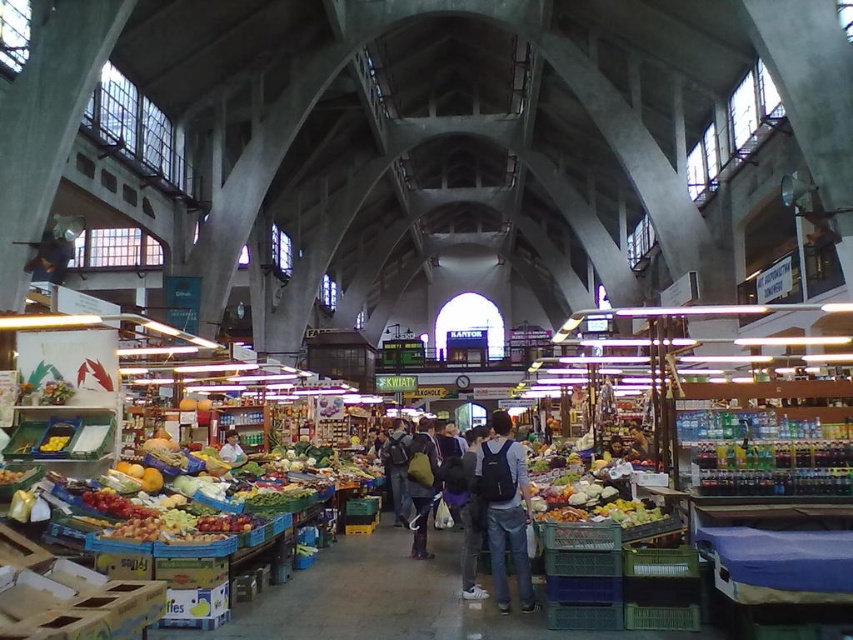
Looking at this image, who is more forward, (514,442) or (225,452)?

Point (514,442) is in front.

Can you confirm if denim jacket at center is taller than light brown leather jacket at center?

Yes, denim jacket at center is taller than light brown leather jacket at center.

Find the location of a particular element. The width and height of the screenshot is (853, 640). denim jacket at center is located at coordinates (505, 508).

Which is more to the right, matte yellow backpack at center or light brown leather jacket at center?

Positioned to the right is matte yellow backpack at center.

Does matte yellow backpack at center have a greater width compared to light brown leather jacket at center?

Yes, matte yellow backpack at center is wider than light brown leather jacket at center.

The width and height of the screenshot is (853, 640). What do you see at coordinates (421, 484) in the screenshot?
I see `matte yellow backpack at center` at bounding box center [421, 484].

The height and width of the screenshot is (640, 853). Find the location of `matte yellow backpack at center`. matte yellow backpack at center is located at coordinates (421, 484).

Between dark blue backpack at center and denim jacket at center, which one is positioned lower?

dark blue backpack at center

Between dark blue backpack at center and denim jacket at center, which one has more height?

dark blue backpack at center is taller.

Is point (496, 566) positioned before point (517, 525)?

No, it is behind (517, 525).

Locate an element on the screen. The width and height of the screenshot is (853, 640). dark blue backpack at center is located at coordinates (497, 512).